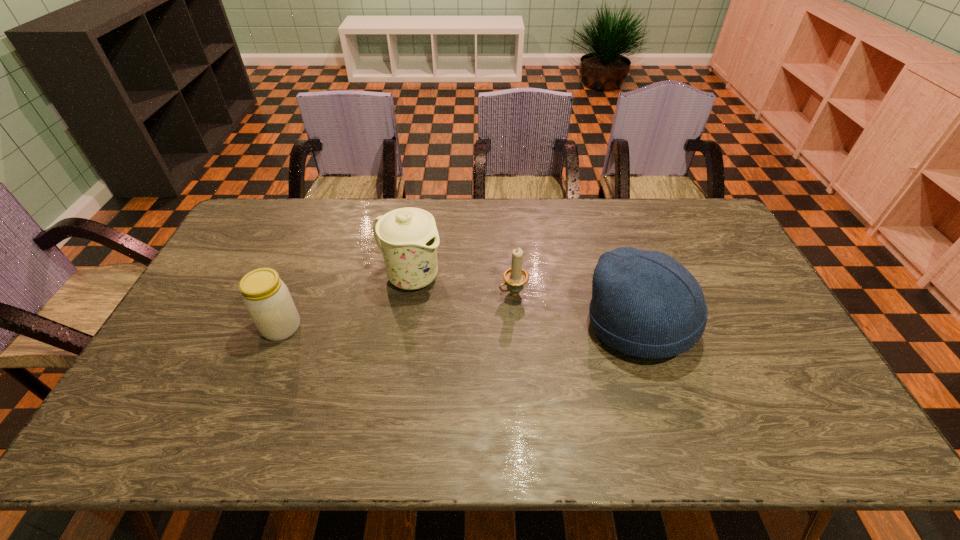
Image resolution: width=960 pixels, height=540 pixels. Find the location of `vacant space located 0.090m on the handle side of the candle_holder`. vacant space located 0.090m on the handle side of the candle_holder is located at coordinates (474, 309).

You are a GUI agent. You are given a task and a screenshot of the screen. Output one action in this format:
    pyautogui.click(x=<x>, y=<y>)
    Task: Click on the vacant space located 0.210m on the handle side of the candle_holder
    The width and height of the screenshot is (960, 540).
    Given the screenshot: What is the action you would take?
    pyautogui.click(x=438, y=326)

In the image, there is a desktop. At what (x,y) coordinates should I click in order to perform the action: click on vacant area at the far edge. Please return your answer as a coordinate pair (x, y). The height and width of the screenshot is (540, 960). Looking at the image, I should click on [x=612, y=227].

This screenshot has width=960, height=540. What are the coordinates of `vacant space at the near edge of the desktop` in the screenshot? It's located at (430, 393).

In the image, there is a desktop. Where is `free space at the right edge`? This screenshot has height=540, width=960. free space at the right edge is located at coordinates (755, 335).

Locate an element on the screen. Image resolution: width=960 pixels, height=540 pixels. free space at the far left corner of the desktop is located at coordinates (292, 202).

You are a GUI agent. You are given a task and a screenshot of the screen. Output one action in this format:
    pyautogui.click(x=<x>, y=<y>)
    Task: Click on the vacant area that lies between the chinaware and the third object from left to right
    
    Given the screenshot: What is the action you would take?
    pyautogui.click(x=462, y=285)

Where is `free point between the jar and the second object from left to right`? free point between the jar and the second object from left to right is located at coordinates (346, 302).

Locate an element on the screen. vacant area between the leftmost object and the second object from right to left is located at coordinates (397, 310).

Where is `free space between the skullcap and the chinaware`? free space between the skullcap and the chinaware is located at coordinates (525, 301).